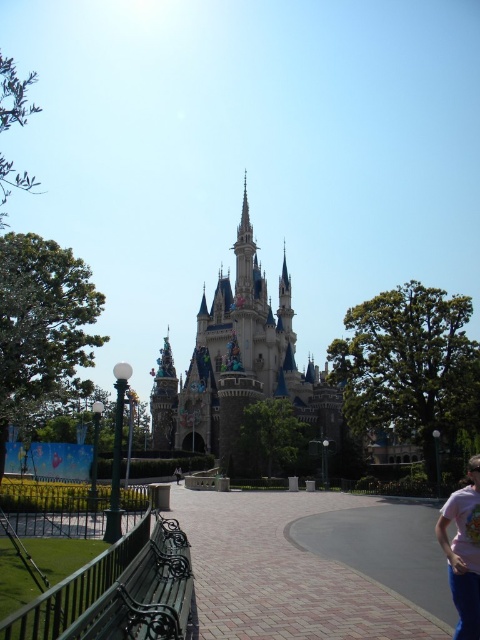
Question: Estimate the real-world distances between objects in this image. Which object is farther from the satin blue castle at center?

Choices:
 (A) green wrought iron bench at lower left
 (B) pink cotton t-shirt at lower right
 (C) sandy blue stone castle at center

Answer: (B)

Question: Considering the relative positions of satin blue castle at center and pink cotton t-shirt at lower right in the image provided, where is satin blue castle at center located with respect to pink cotton t-shirt at lower right?

Choices:
 (A) right
 (B) left

Answer: (B)

Question: Which of the following is the farthest from the observer?

Choices:
 (A) (457, 545)
 (B) (116, 598)

Answer: (A)

Question: Is satin blue castle at center further to the viewer compared to green wrought iron bench at lower left?

Choices:
 (A) yes
 (B) no

Answer: (A)

Question: From the image, what is the correct spatial relationship of satin blue castle at center in relation to pink cotton t-shirt at lower right?

Choices:
 (A) below
 (B) above

Answer: (B)

Question: Which of the following is the farthest from the observer?

Choices:
 (A) pink cotton t-shirt at lower right
 (B) sandy blue stone castle at center
 (C) green wrought iron bench at lower left
 (D) satin blue castle at center

Answer: (B)